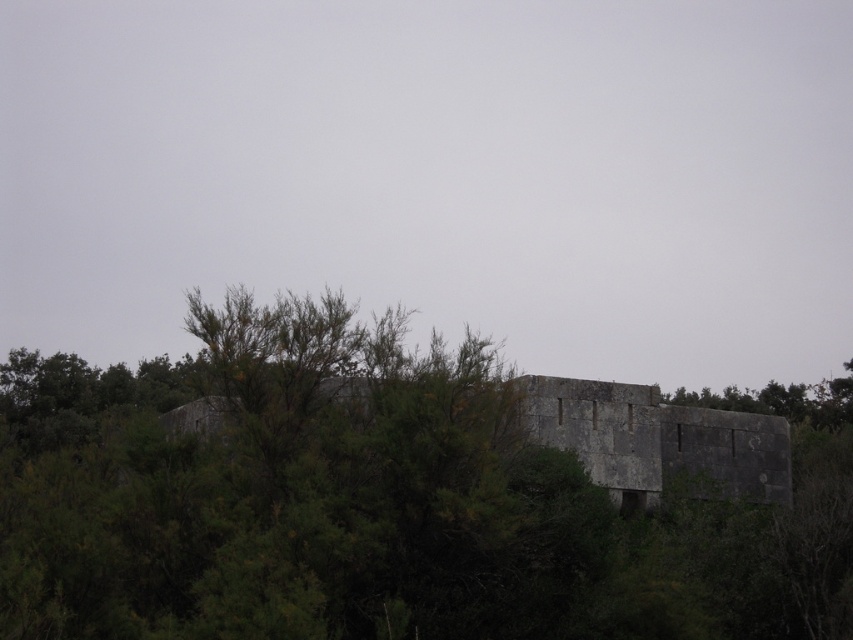
You are standing at the point marked as point (x=396, y=497) in the scene. What is directly beneath your feet?

The point (x=396, y=497) is on green leafy tree at center, so the area beneath your feet is part of the green leafy tree at center.

You are standing at the center of the image and want to walk towards the green leafy tree at center. In which direction should you move?

The green leafy tree at center is located at the center of the image, so you are already facing it. Move straight ahead.